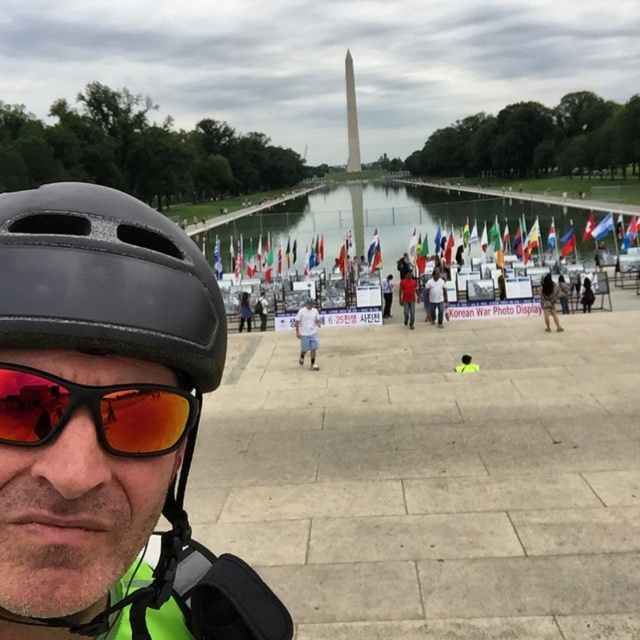
Question: Based on their relative distances, which object is farther from the light blue shirt at center?

Choices:
 (A) yellow reflective vest at center
 (B) white shirt at center

Answer: (A)

Question: Does red fabric shirt at center lie in front of brown fabric pants at center-right?

Choices:
 (A) yes
 (B) no

Answer: (B)

Question: Can you confirm if white shirt at center is thinner than red fabric shirt at center?

Choices:
 (A) no
 (B) yes

Answer: (A)

Question: Is matte black helmet at left further to camera compared to white cotton shirt at center?

Choices:
 (A) no
 (B) yes

Answer: (A)

Question: Estimate the real-world distances between objects in this image. Which object is closer to the red reflective lens at center?

Choices:
 (A) dark blue jeans at center
 (B) dark gray helmet at center
 (C) white shirt at center

Answer: (C)

Question: Which object appears farthest from the camera in this image?

Choices:
 (A) white shirt at center
 (B) dark gray helmet at center
 (C) blue fabric flag at center

Answer: (C)